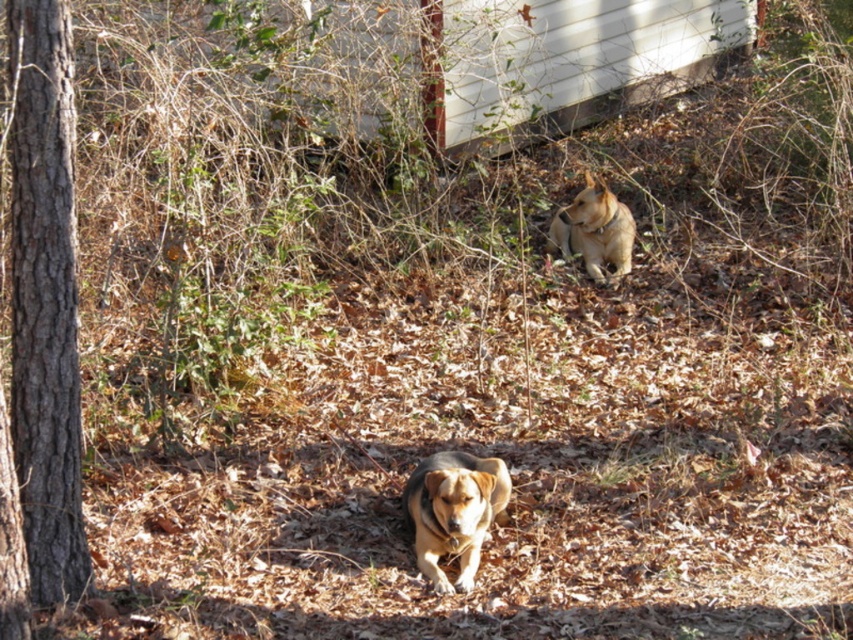
Question: Is brown rough bark tree at left in front of brown fur dog at upper center?

Choices:
 (A) yes
 (B) no

Answer: (A)

Question: Which point is farther to the camera?

Choices:
 (A) brown rough bark tree at left
 (B) brown fur dog at center

Answer: (B)

Question: Does brown fur dog at center have a larger size compared to brown fur dog at upper center?

Choices:
 (A) no
 (B) yes

Answer: (A)

Question: Which is farther from the brown fur dog at upper center?

Choices:
 (A) brown fur dog at center
 (B) brown rough bark tree at left

Answer: (B)

Question: Among these points, which one is farthest from the camera?

Choices:
 (A) (614, 250)
 (B) (486, 474)

Answer: (A)

Question: Is the position of brown fur dog at center more distant than that of brown fur dog at upper center?

Choices:
 (A) no
 (B) yes

Answer: (A)